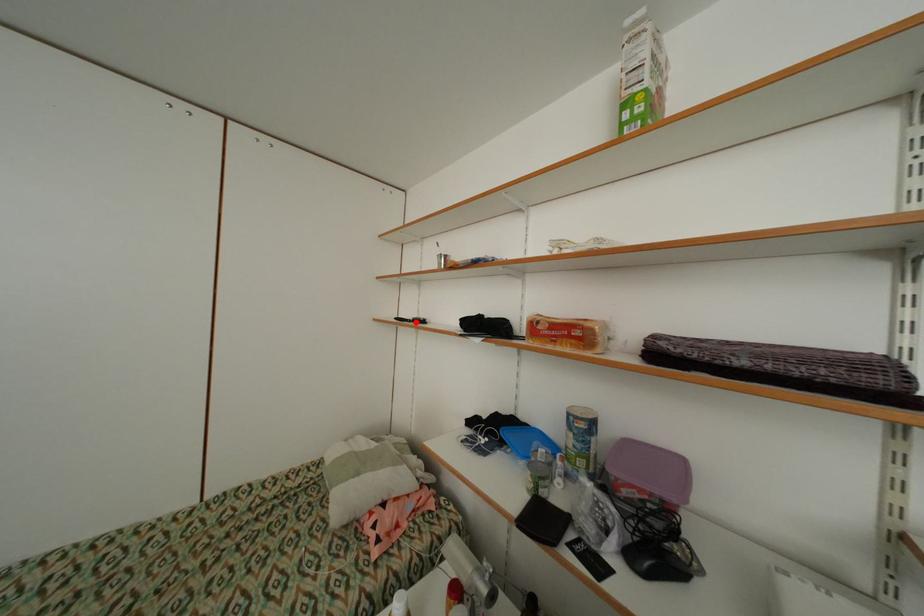
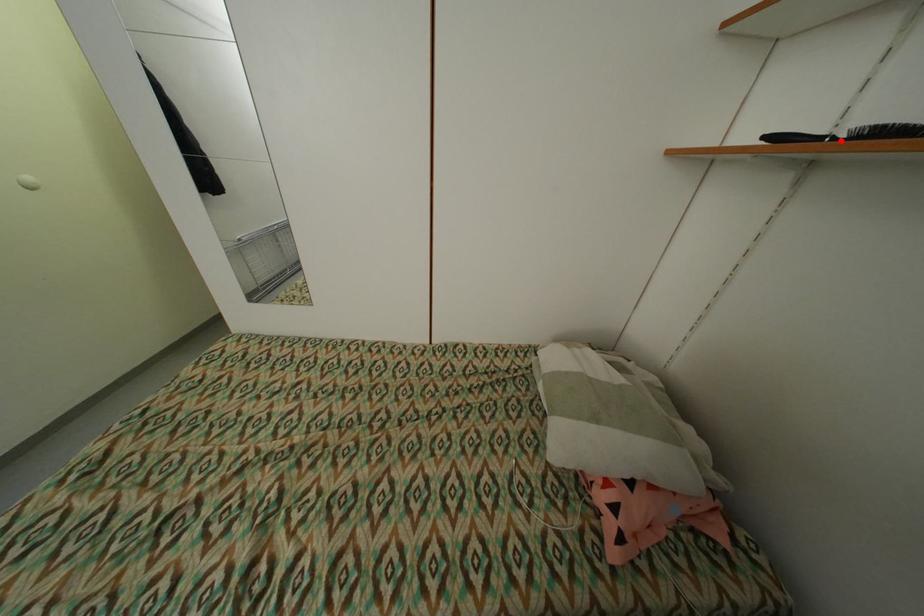
I am providing you with two images of the same scene from different viewpoints. A red point is marked on the first image and another point is marked on the second image. Does the point marked in image1 correspond to the same location as the one in image2?

Yes